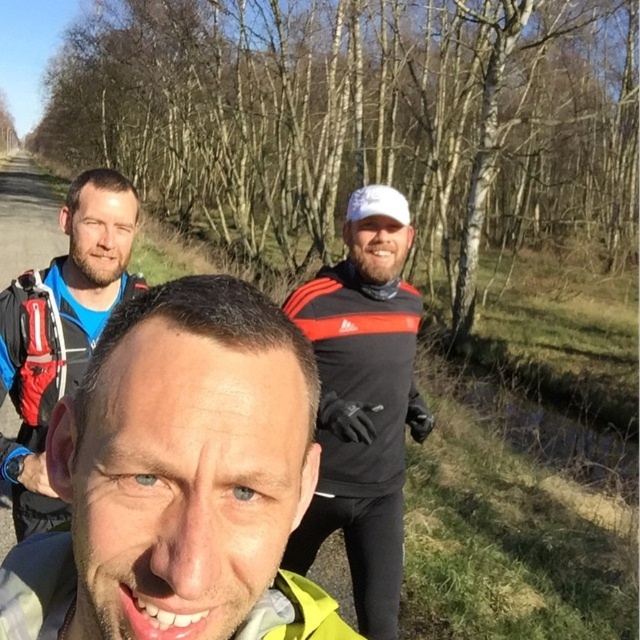
Is point (381, 323) farther from camera compared to point (45, 342)?

Yes, it is.

This screenshot has width=640, height=640. In order to click on black matte jacket at center in this screenshot , I will do `click(364, 403)`.

This screenshot has width=640, height=640. What are the coordinates of `black matte jacket at center` in the screenshot? It's located at (364, 403).

Locate an element on the screen. The height and width of the screenshot is (640, 640). black matte jacket at center is located at coordinates (364, 403).

Is matte black jacket at center thinner than matte blue jacket at upper left?

Correct, matte black jacket at center's width is less than matte blue jacket at upper left's.

Which is in front, point (268, 401) or point (33, 490)?

Positioned in front is point (268, 401).

I want to click on matte black jacket at center, so click(x=179, y=480).

Between matte black jacket at center and black matte jacket at center, which one has less height?

Standing shorter between the two is matte black jacket at center.

Which is behind, point (116, 371) or point (362, 253)?

The point (362, 253) is more distant.

Is point (296, 332) positioned behind point (378, 554)?

No, it is not.

Find the location of `matte black jacket at center`. matte black jacket at center is located at coordinates (179, 480).